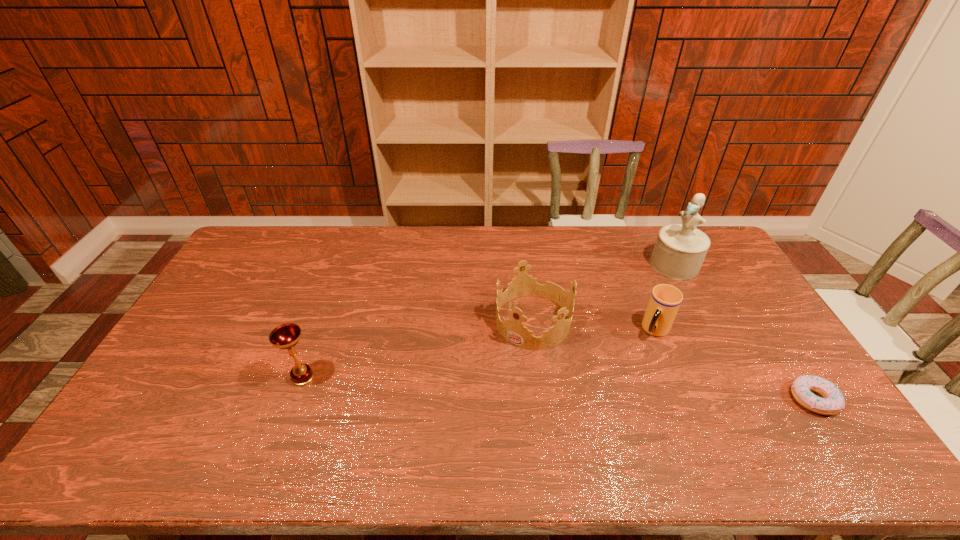
In order to click on chalice in this screenshot , I will do `click(286, 336)`.

This screenshot has height=540, width=960. What are the coordinates of `the shortest object` in the screenshot? It's located at (832, 403).

You are a GUI agent. You are given a task and a screenshot of the screen. Output one action in this format:
    pyautogui.click(x=<x>, y=<y>)
    Task: Click on the rightmost object
    The image size is (960, 540).
    Given the screenshot: What is the action you would take?
    pyautogui.click(x=832, y=403)

Identify the location of figurine. Image resolution: width=960 pixels, height=540 pixels. (680, 249).

Find the location of a particular element. the fourth object from left to right is located at coordinates (680, 249).

At what (x,y) coordinates should I click in order to perform the action: click on the fourth object from right to left. Please return your answer as a coordinate pair (x, y). The height and width of the screenshot is (540, 960). Looking at the image, I should click on (513, 330).

Locate an element on the screen. The width and height of the screenshot is (960, 540). the third object from right to left is located at coordinates (665, 300).

Locate an element on the screen. The image size is (960, 540). free point located on the right of the leftmost object is located at coordinates (352, 377).

Image resolution: width=960 pixels, height=540 pixels. I want to click on free spot located 0.310m on the back of the doughnut, so click(x=750, y=303).

Identify the location of vacant space located at the beak of the figurine. The image size is (960, 540). (601, 320).